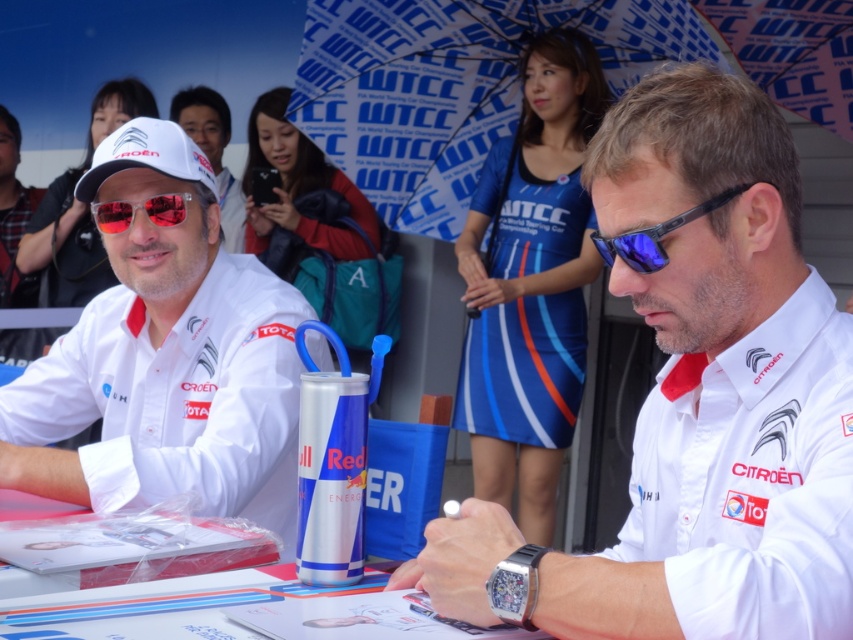
Who is taller, blue printed umbrella at upper center or blue fabric dress at upper center?

blue fabric dress at upper center is taller.

Which of these two, blue printed umbrella at upper center or blue fabric dress at upper center, stands shorter?

blue printed umbrella at upper center is shorter.

This screenshot has width=853, height=640. What are the coordinates of `blue printed umbrella at upper center` in the screenshot? It's located at (453, 84).

Image resolution: width=853 pixels, height=640 pixels. I want to click on blue printed umbrella at upper center, so click(x=453, y=84).

Does blue fabric dress at upper center have a greater width compared to blue reflective lens sunglasses at center?

Yes.

Does blue fabric dress at upper center lie in front of blue reflective lens sunglasses at center?

No.

Who is more distant from viewer, (596,65) or (613,248)?

The point (596,65) is behind.

Locate an element on the screen. The width and height of the screenshot is (853, 640). blue fabric dress at upper center is located at coordinates (531, 284).

Who is more forward, [692,301] or [596,36]?

Point [692,301] is in front.

How distant is white matte shirt at center from blue printed umbrella at upper center?

They are 7.46 feet apart.

This screenshot has height=640, width=853. I want to click on white matte shirt at center, so click(695, 397).

The image size is (853, 640). I want to click on white matte shirt at center, so click(695, 397).